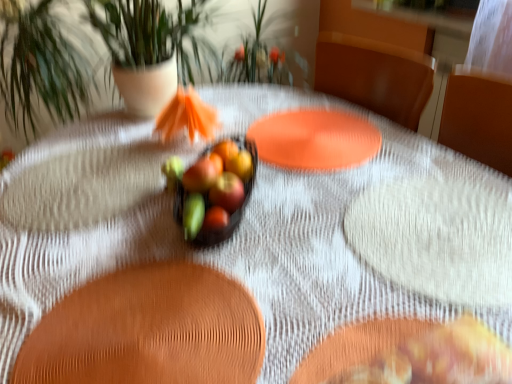
This screenshot has width=512, height=384. Identify the location of free location above glossy ceramic grapefruit at center (from a real-world perspective). (209, 178).